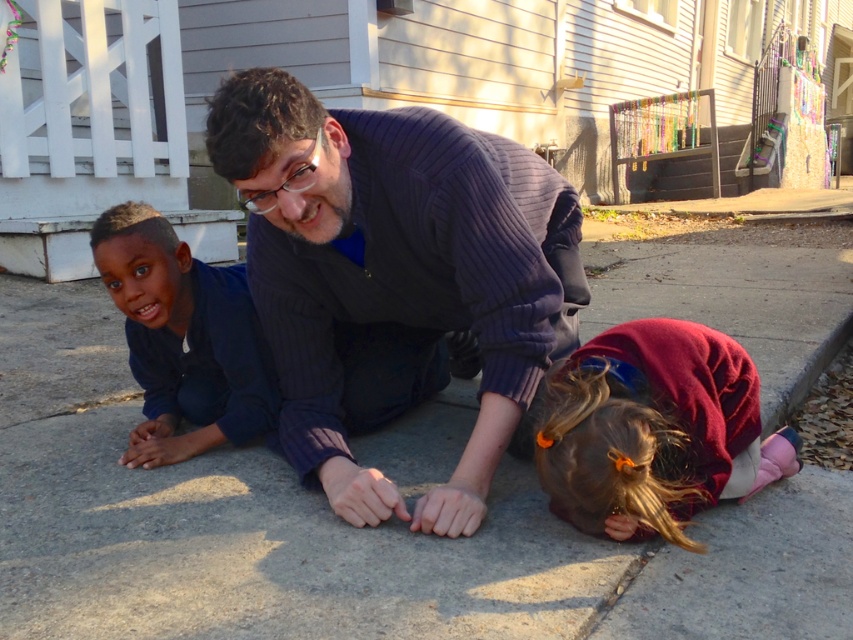
Question: Considering the real-world distances, which object is farthest from the smooth navy blue shirt at left?

Choices:
 (A) gray concrete pavement at center
 (B) maroon fleece jacket at lower right
 (C) dark blue sweater at center

Answer: (A)

Question: From the image, what is the correct spatial relationship of gray concrete pavement at center in relation to dark blue sweater at center?

Choices:
 (A) above
 (B) below

Answer: (A)

Question: Is gray concrete pavement at center bigger than smooth navy blue shirt at left?

Choices:
 (A) no
 (B) yes

Answer: (A)

Question: Which point appears closest to the camera in this image?

Choices:
 (A) (44, 378)
 (B) (204, 417)
 (C) (775, 464)

Answer: (C)

Question: Considering the real-world distances, which object is farthest from the gray concrete pavement at center?

Choices:
 (A) dark blue sweater at center
 (B) maroon fleece jacket at lower right
 (C) smooth navy blue shirt at left

Answer: (C)

Question: Considering the relative positions of gray concrete pavement at center and dark blue sweater at center in the image provided, where is gray concrete pavement at center located with respect to dark blue sweater at center?

Choices:
 (A) right
 (B) left

Answer: (A)